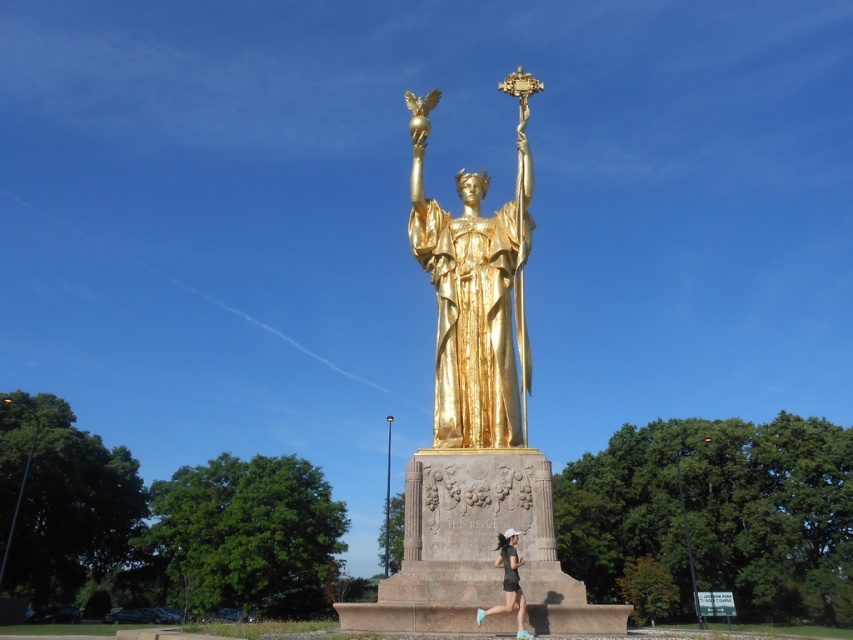
Question: Which of these objects is positioned closest to the matte black shorts at lower center?

Choices:
 (A) gold statue at center
 (B) gold polished statue at center

Answer: (B)

Question: Which point appears closest to the camera in this image?

Choices:
 (A) (503, 403)
 (B) (495, 611)

Answer: (B)

Question: Estimate the real-world distances between objects in this image. Which object is farther from the gold polished statue at center?

Choices:
 (A) gold statue at center
 (B) matte black shorts at lower center

Answer: (B)

Question: Does gold statue at center have a lesser width compared to matte black shorts at lower center?

Choices:
 (A) no
 (B) yes

Answer: (A)

Question: In this image, where is gold statue at center located relative to matte black shorts at lower center?

Choices:
 (A) right
 (B) left

Answer: (B)

Question: Is gold polished statue at center to the left of gold statue at center from the viewer's perspective?

Choices:
 (A) yes
 (B) no

Answer: (A)